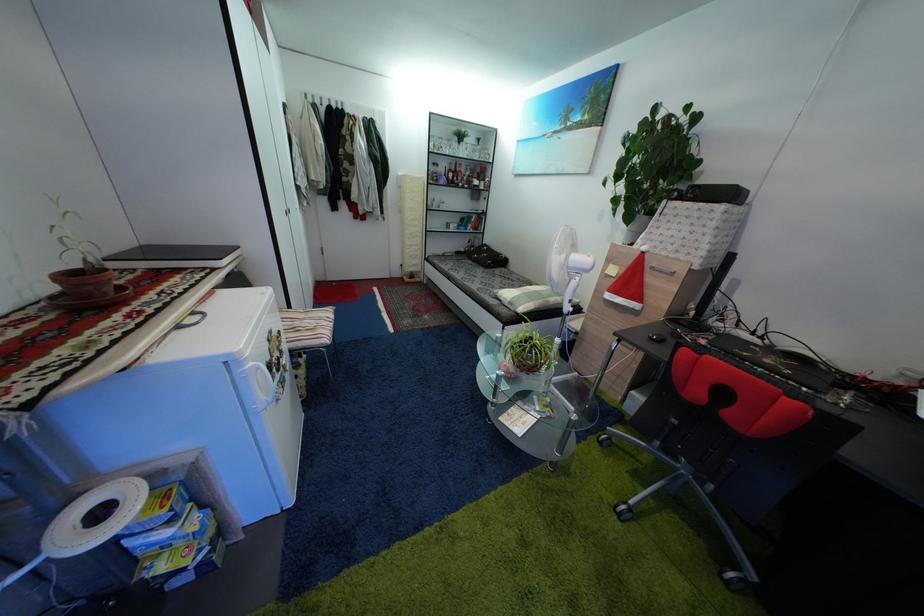
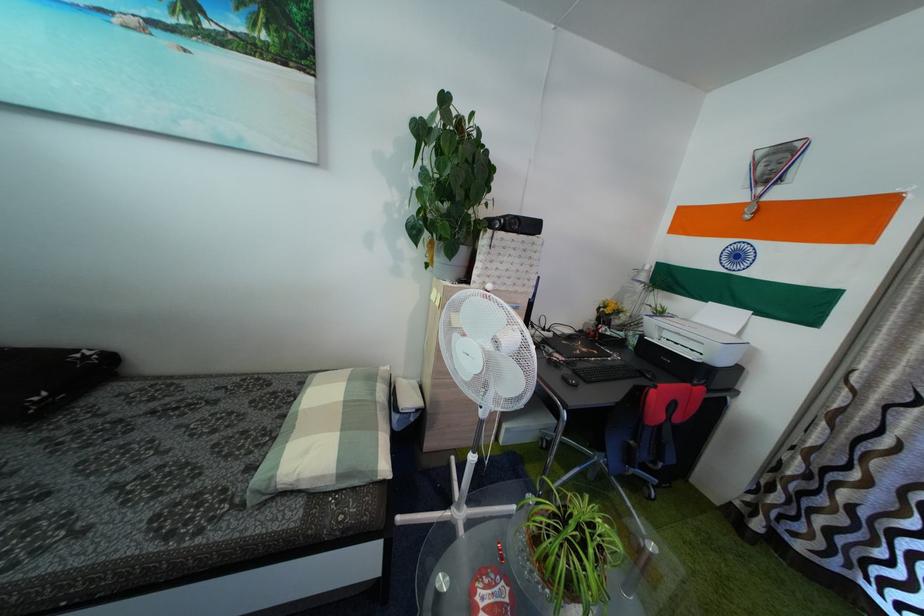
The point at (x=517, y=310) is marked in the first image. Where is the corresponding point in the second image?

(347, 483)